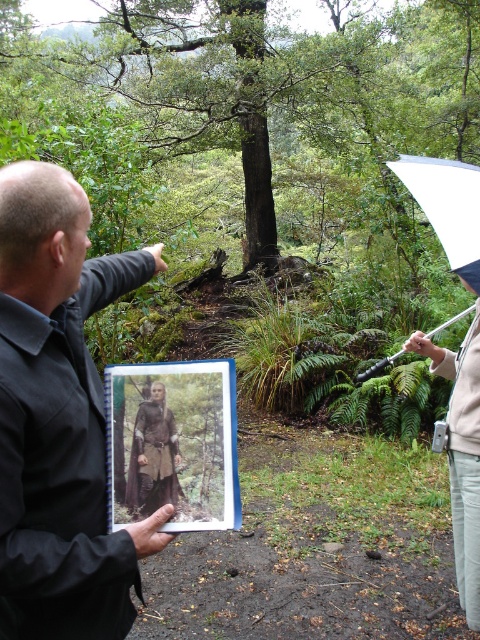
You are a hiker preparing for a rainy hike and have both the dark brown leather jacket at upper left and the white matte umbrella at upper right. Which item should you choose if you want the larger one to stay dry?

The dark brown leather jacket at upper left is larger than the white matte umbrella at upper right, so you should choose the dark brown leather jacket at upper left to stay dry.

Consider the image. You are a hiker trying to locate your friend in the forest. You see a dark brown leather jacket at upper left and light beige pants at right. Which clothing item is located more to the left?

The dark brown leather jacket at upper left is more to the left than the light beige pants at right.

What object is located at the coordinate point (60, 417) in the image?

The dark brown leather jacket at upper left is located at the coordinate point (60, 417) in the image.